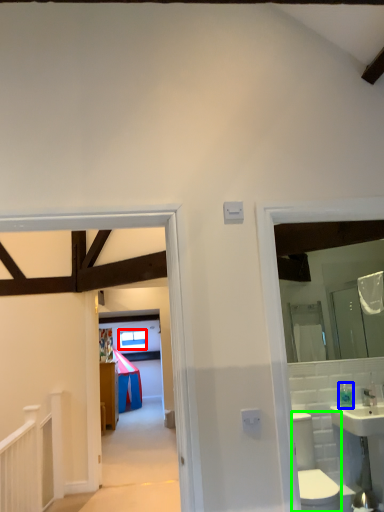
Question: Which object is positioned closest to window (highlighted by a red box)? Select from toiletry (highlighted by a blue box) and toilet bowl (highlighted by a green box).

Choices:
 (A) toiletry
 (B) toilet bowl

Answer: (A)